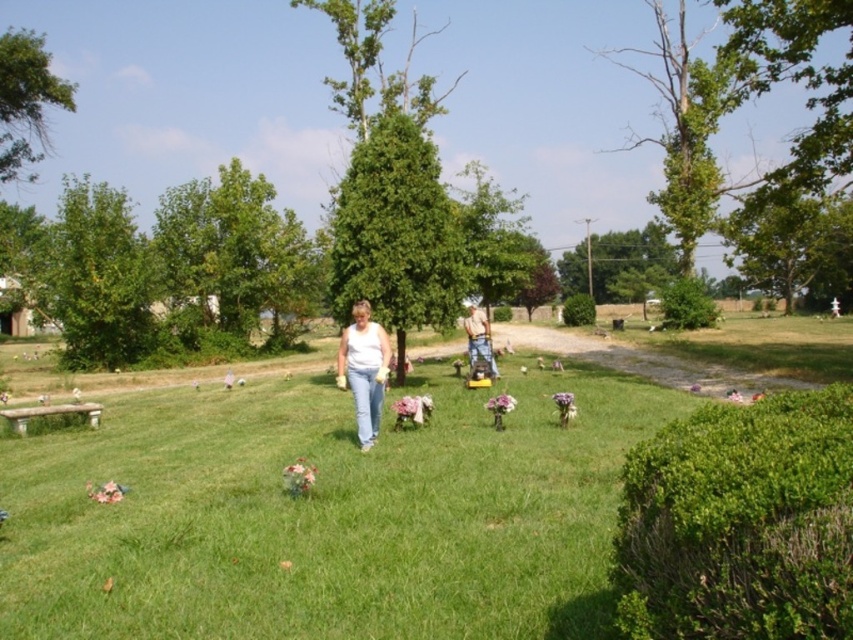
Question: Which of these objects is positioned farthest from the white cotton shirt at center?

Choices:
 (A) green grass lawn at center
 (B) denim jeans at center

Answer: (B)

Question: Which object is positioned farthest from the green grass lawn at center?

Choices:
 (A) denim jeans at center
 (B) white cotton shirt at center

Answer: (A)

Question: From the image, what is the correct spatial relationship of green grass lawn at center in relation to denim jeans at center?

Choices:
 (A) below
 (B) above

Answer: (A)

Question: Which point is farther to the camera?

Choices:
 (A) white cotton shirt at center
 (B) green grass lawn at center
 (C) denim jeans at center

Answer: (C)

Question: Is green grass lawn at center wider than white cotton shirt at center?

Choices:
 (A) yes
 (B) no

Answer: (A)

Question: Does green grass lawn at center come behind denim jeans at center?

Choices:
 (A) yes
 (B) no

Answer: (B)